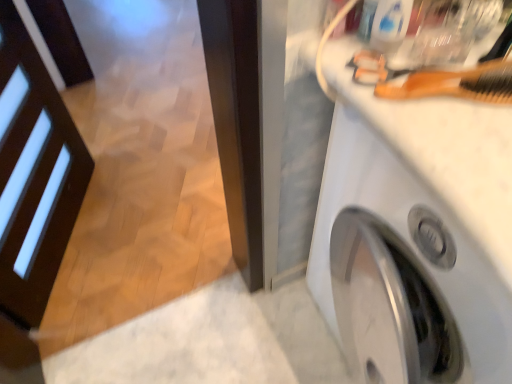
Describe the element at coordinates (402, 271) in the screenshot. I see `white glossy washing machine at upper right` at that location.

Locate an element on the screen. This screenshot has height=384, width=512. white glossy washing machine at upper right is located at coordinates (402, 271).

This screenshot has height=384, width=512. Describe the element at coordinates (436, 80) in the screenshot. I see `wooden comb at upper right` at that location.

You are a GUI agent. You are given a task and a screenshot of the screen. Output one action in this format:
    pyautogui.click(x=<x>, y=<y>)
    Task: Click on the wooden comb at upper right
    
    Given the screenshot: What is the action you would take?
    pyautogui.click(x=436, y=80)

The height and width of the screenshot is (384, 512). In order to click on white glossy washing machine at upper right in this screenshot , I will do `click(402, 271)`.

Is wooden comb at upper right to the left of white glossy washing machine at upper right from the viewer's perspective?

Correct, you'll find wooden comb at upper right to the left of white glossy washing machine at upper right.

Considering the positions of objects wooden comb at upper right and white glossy washing machine at upper right in the image provided, who is in front, wooden comb at upper right or white glossy washing machine at upper right?

Positioned in front is white glossy washing machine at upper right.

Which is less distant, (382,80) or (407,331)?

The point (382,80) is more forward.

From the image's perspective, would you say wooden comb at upper right is positioned over white glossy washing machine at upper right?

Yes.

From a real-world perspective, is wooden comb at upper right on white glossy washing machine at upper right?

Yes, from a real-world perspective, wooden comb at upper right is over white glossy washing machine at upper right

Which of these two, wooden comb at upper right or white glossy washing machine at upper right, is thinner?

Thinner between the two is wooden comb at upper right.

From the picture: Considering the relative sizes of wooden comb at upper right and white glossy washing machine at upper right in the image provided, is wooden comb at upper right taller than white glossy washing machine at upper right?

Incorrect, the height of wooden comb at upper right is not larger of that of white glossy washing machine at upper right.

Based on the photo, between wooden comb at upper right and white glossy washing machine at upper right, which one has larger size?

white glossy washing machine at upper right is bigger.

Is wooden comb at upper right inside the boundaries of white glossy washing machine at upper right, or outside?

wooden comb at upper right is located beyond the bounds of white glossy washing machine at upper right.

Is wooden comb at upper right next to white glossy washing machine at upper right and touching it?

No, wooden comb at upper right is not touching white glossy washing machine at upper right.

Could you tell me if wooden comb at upper right is facing white glossy washing machine at upper right?

No.

Find the location of a particular element. washing machine below the wooden comb at upper right (from the image's perspective) is located at coordinates (402, 271).

Looking at this image, based on their positions, is white glossy washing machine at upper right located to the left or right of wooden comb at upper right?

white glossy washing machine at upper right is to the right of wooden comb at upper right.

Who is more distant, white glossy washing machine at upper right or wooden comb at upper right?

wooden comb at upper right is behind.

Does point (365, 231) lie in front of point (431, 80)?

That is False.

From the image's perspective, relative to wooden comb at upper right, is white glossy washing machine at upper right above or below?

white glossy washing machine at upper right is below wooden comb at upper right.

From a real-world perspective, is white glossy washing machine at upper right above or below wooden comb at upper right?

Clearly, from a real-world perspective, white glossy washing machine at upper right is below wooden comb at upper right.

Which of these two, white glossy washing machine at upper right or wooden comb at upper right, is wider?

white glossy washing machine at upper right.

Considering the sizes of white glossy washing machine at upper right and wooden comb at upper right in the image, is white glossy washing machine at upper right taller or shorter than wooden comb at upper right?

Clearly, white glossy washing machine at upper right is taller compared to wooden comb at upper right.

Can you confirm if white glossy washing machine at upper right is bigger than wooden comb at upper right?

Correct, white glossy washing machine at upper right is larger in size than wooden comb at upper right.

Is white glossy washing machine at upper right located outside wooden comb at upper right?

white glossy washing machine at upper right lies outside wooden comb at upper right's area.

Is white glossy washing machine at upper right not near wooden comb at upper right?

Actually, white glossy washing machine at upper right and wooden comb at upper right are a little close together.

Is white glossy washing machine at upper right turned away from wooden comb at upper right?

No, wooden comb at upper right is not at the back of white glossy washing machine at upper right.

What's the angular difference between white glossy washing machine at upper right and wooden comb at upper right's facing directions?

There is a 61.8-degree angle between the facing directions of white glossy washing machine at upper right and wooden comb at upper right.

The image size is (512, 384). I want to click on washing machine located below the wooden comb at upper right (from the image's perspective), so click(x=402, y=271).

Where is `brush that appears above the white glossy washing machine at upper right (from a real-world perspective)`? This screenshot has height=384, width=512. brush that appears above the white glossy washing machine at upper right (from a real-world perspective) is located at coordinates (436, 80).

Identify the location of washing machine on the right of wooden comb at upper right. Image resolution: width=512 pixels, height=384 pixels. (402, 271).